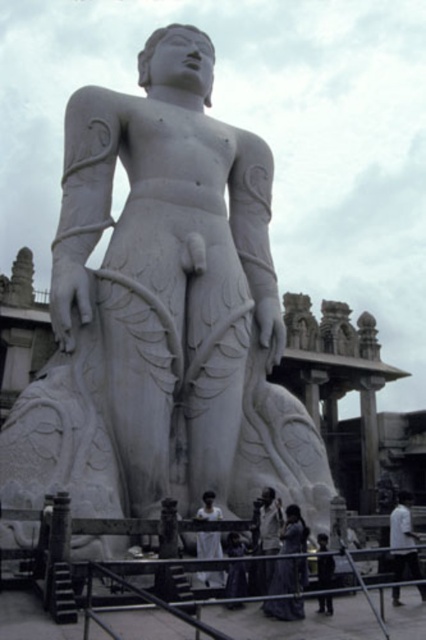
You are a painter standing at the point marked as point (287,576). You want to paint the statue of the nude male figure. What object is directly in front of you at your current position?

The silky purple dress at center is located at point (287,576), so that is what is directly in front of you.

You are a fashion designer who needs to decide which fabric to use for a new dress design. You have two options in front of you, the silky purple dress at center and the dark gray fabric at center. Based on their sizes, which one would you choose if you want a wider fabric for the dress?

The silky purple dress at center has a larger width than the dark gray fabric at center, so you should choose the silky purple dress at center for a wider fabric.

You are standing in front of the statue and notice a point marked at coordinates [268,520]. Based on the scene, what object does this point correspond to?

The point at coordinates [268,520] corresponds to the white fabric dress at center.